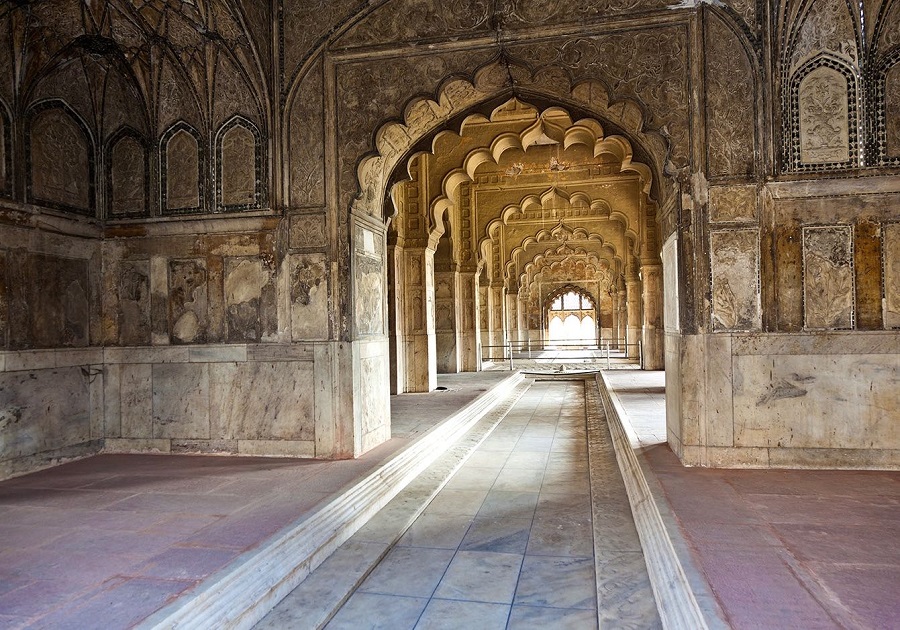
This screenshot has width=900, height=630. I want to click on detailed walls, so click(x=318, y=164), click(x=688, y=98).